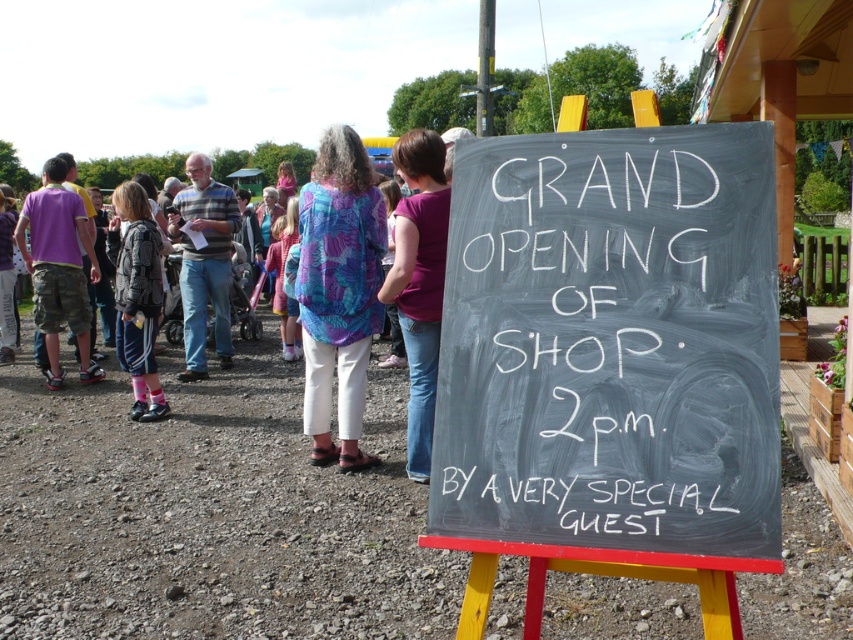
Can you confirm if purple fabric shirt at center is positioned below camo pants at left?

Correct, purple fabric shirt at center is located below camo pants at left.

Image resolution: width=853 pixels, height=640 pixels. I want to click on purple fabric shirt at center, so click(419, 282).

Find the location of a particular element. Image resolution: width=853 pixels, height=640 pixels. printed fabric blouse at center is located at coordinates (339, 291).

What do you see at coordinates (339, 291) in the screenshot? Image resolution: width=853 pixels, height=640 pixels. I see `printed fabric blouse at center` at bounding box center [339, 291].

I want to click on printed fabric blouse at center, so click(339, 291).

Can you confirm if printed fabric blouse at center is bigger than camo pants at left?

Incorrect, printed fabric blouse at center is not larger than camo pants at left.

Find the location of `printed fabric blouse at center`. printed fabric blouse at center is located at coordinates (339, 291).